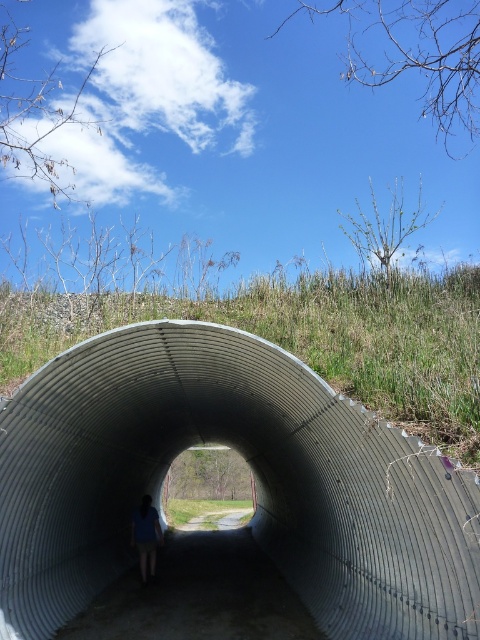
Question: Is metallic silver tunnel at center smaller than blue fabric shirt at center?

Choices:
 (A) no
 (B) yes

Answer: (A)

Question: Where is metallic silver tunnel at center located in relation to blue fabric shirt at center in the image?

Choices:
 (A) below
 (B) above

Answer: (B)

Question: Does metallic silver tunnel at center have a smaller size compared to blue fabric shirt at center?

Choices:
 (A) no
 (B) yes

Answer: (A)

Question: Which point appears farthest from the camera in this image?

Choices:
 (A) (76, 579)
 (B) (145, 497)

Answer: (B)

Question: Which point is closer to the camera?

Choices:
 (A) blue fabric shirt at center
 (B) metallic silver tunnel at center

Answer: (B)